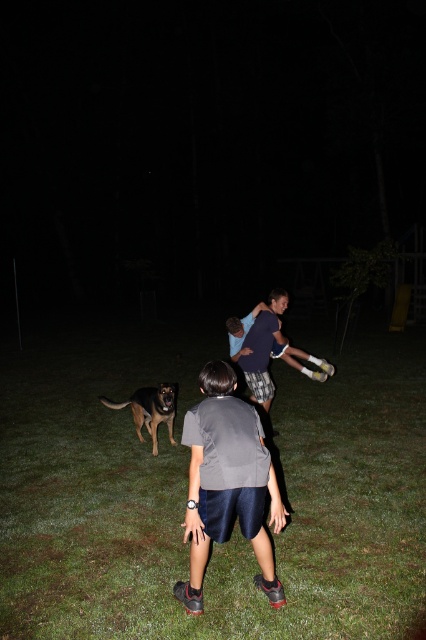
Question: Which point is closer to the camera?

Choices:
 (A) (109, 596)
 (B) (158, 420)
 (C) (238, 426)

Answer: (C)

Question: Considering the relative positions of green grass at center and brown fur dog at lower left in the image provided, where is green grass at center located with respect to brown fur dog at lower left?

Choices:
 (A) above
 (B) below

Answer: (B)

Question: Can you confirm if gray fabric shirt at center is positioned below brown fur dog at lower left?

Choices:
 (A) no
 (B) yes

Answer: (A)

Question: Among these objects, which one is farthest from the camera?

Choices:
 (A) green grass at center
 (B) brown fur dog at lower left

Answer: (B)

Question: Among these points, which one is farthest from the camera?

Choices:
 (A) (160, 403)
 (B) (268, 572)

Answer: (A)

Question: Can you confirm if green grass at center is thinner than brown fur dog at lower left?

Choices:
 (A) yes
 (B) no

Answer: (B)